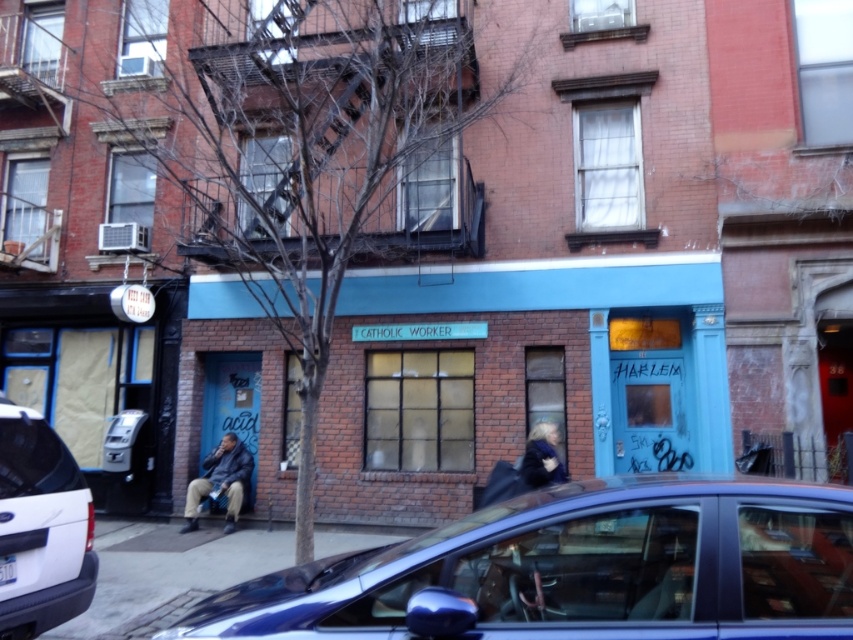
Can you confirm if metallic blue sedan at lower center is bigger than dark blue jacket at lower left?

Yes, metallic blue sedan at lower center is bigger than dark blue jacket at lower left.

Which of these two, metallic blue sedan at lower center or dark blue jacket at lower left, stands shorter?

metallic blue sedan at lower center is shorter.

The width and height of the screenshot is (853, 640). What do you see at coordinates (576, 570) in the screenshot?
I see `metallic blue sedan at lower center` at bounding box center [576, 570].

Image resolution: width=853 pixels, height=640 pixels. What are the coordinates of `metallic blue sedan at lower center` in the screenshot? It's located at (576, 570).

Who is taller, metallic blue sedan at lower center or dark blue jacket at center?

With more height is metallic blue sedan at lower center.

Measure the distance between point (737, 605) and camera.

Point (737, 605) is 2.12 meters away from camera.

What do you see at coordinates (576, 570) in the screenshot? The width and height of the screenshot is (853, 640). I see `metallic blue sedan at lower center` at bounding box center [576, 570].

Identify the location of metallic blue sedan at lower center. (576, 570).

Who is taller, gray concrete sidewalk at lower center or dark blue jacket at center?

With more height is gray concrete sidewalk at lower center.

Is point (387, 538) farther from camera compared to point (543, 474)?

Yes, it is.

Locate an element on the screen. gray concrete sidewalk at lower center is located at coordinates (167, 573).